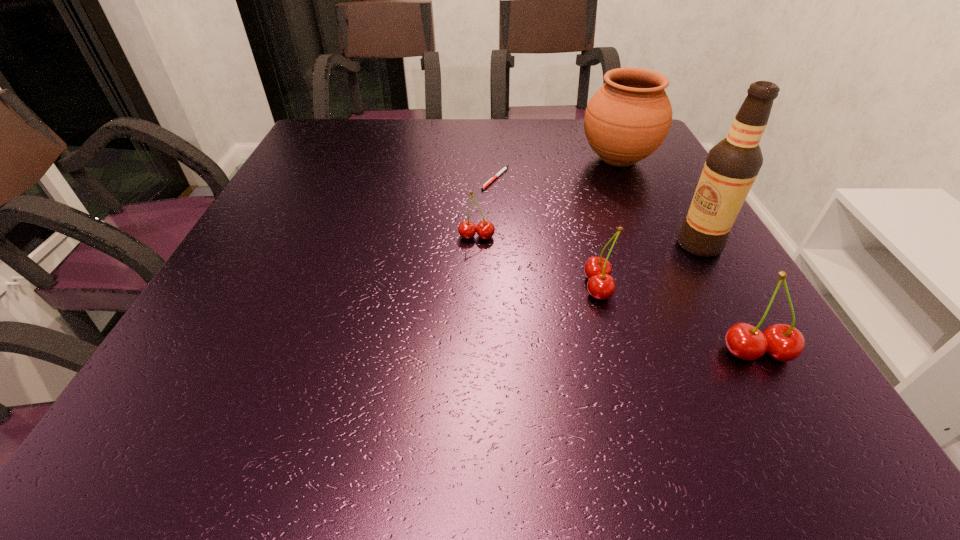
Identify the location of cherry that is at the right edge. This screenshot has height=540, width=960. (784, 343).

The image size is (960, 540). What are the coordinates of `pottery located in the right edge section of the desktop` in the screenshot? It's located at coord(628,118).

Locate an element on the screen. The image size is (960, 540). alcohol at the right edge is located at coordinates (732, 165).

I want to click on object located in the far right corner section of the desktop, so click(628, 118).

Identify the location of object situated at the near right corner. (784, 343).

Locate an element on the screen. This screenshot has width=960, height=540. vacant space at the far edge of the desktop is located at coordinates (468, 139).

Locate an element on the screen. Image resolution: width=960 pixels, height=540 pixels. vacant point at the near edge is located at coordinates (434, 359).

The width and height of the screenshot is (960, 540). In the image, there is a desktop. Find the location of `vacant space at the left edge`. vacant space at the left edge is located at coordinates (271, 314).

Find the location of `vacant space at the right edge`. vacant space at the right edge is located at coordinates (671, 313).

Identify the location of free space at the far left corner of the desktop. Image resolution: width=960 pixels, height=540 pixels. (348, 140).